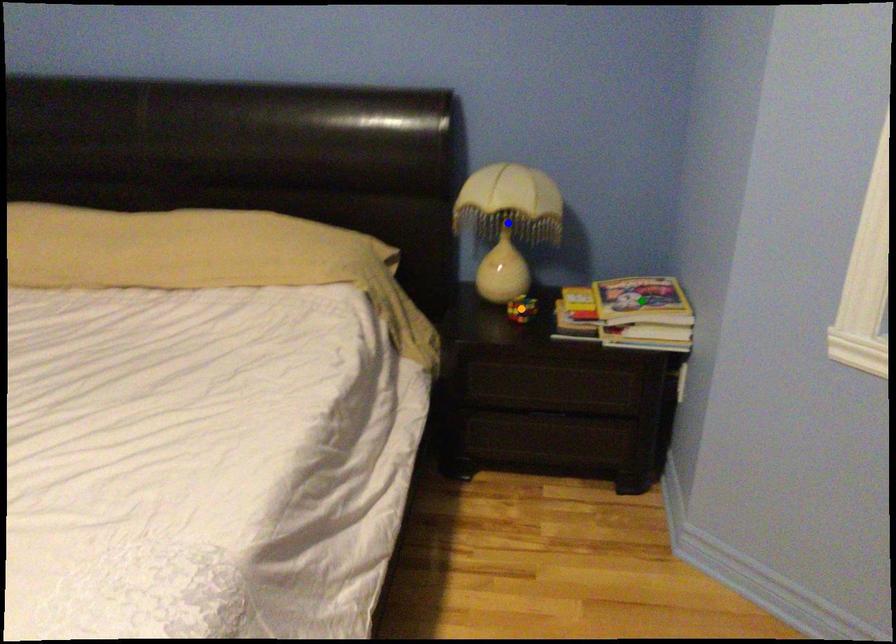
Order these from nearest to farthest:
- orange point
- green point
- blue point

1. green point
2. blue point
3. orange point